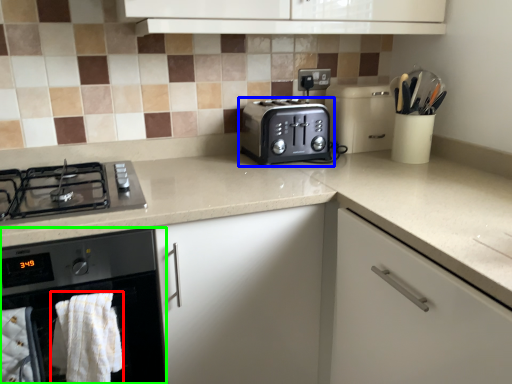
Question: Which object is positioned farthest from bath towel (highlighted by a red box)? Select from toaster (highlighted by a blue box) and home appliance (highlighted by a green box).

Choices:
 (A) toaster
 (B) home appliance

Answer: (A)